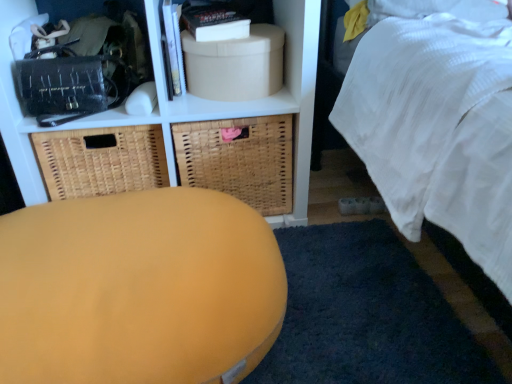
Question: From a real-world perspective, is woven brown basket at left, the 2th basket positioned from the right, located higher than woven brown basket at center, which appears as the second basket when viewed from the left?

Choices:
 (A) no
 (B) yes

Answer: (B)

Question: From a real-world perspective, is woven brown basket at left, the 2th basket positioned from the right, physically below woven brown basket at center, the first basket viewed from the right?

Choices:
 (A) yes
 (B) no

Answer: (B)

Question: Is woven brown basket at center, which appears as the second basket when viewed from the left, at the back of woven brown basket at left, the 2th basket positioned from the right?

Choices:
 (A) yes
 (B) no

Answer: (B)

Question: Can you confirm if woven brown basket at left, the first basket in the left-to-right sequence, is taller than woven brown basket at center, which appears as the second basket when viewed from the left?

Choices:
 (A) yes
 (B) no

Answer: (B)

Question: Is woven brown basket at left, the 2th basket positioned from the right, not near woven brown basket at center, which appears as the second basket when viewed from the left?

Choices:
 (A) no
 (B) yes

Answer: (A)

Question: Does point (309, 155) appear closer or farther from the camera than point (55, 347)?

Choices:
 (A) closer
 (B) farther

Answer: (B)

Question: Choose the correct answer: Is matte white shelf at upper center inside matte yellow ottoman at center or outside it?

Choices:
 (A) inside
 (B) outside

Answer: (B)

Question: Considering the positions of matte white shelf at upper center and matte yellow ottoman at center in the image, is matte white shelf at upper center wider or thinner than matte yellow ottoman at center?

Choices:
 (A) wide
 (B) thin

Answer: (B)

Question: Is matte white shelf at upper center to the left or to the right of matte yellow ottoman at center in the image?

Choices:
 (A) right
 (B) left

Answer: (A)

Question: From their relative heights in the image, would you say woven brown basket at center, the first basket viewed from the right, is taller or shorter than matte yellow ottoman at center?

Choices:
 (A) tall
 (B) short

Answer: (A)

Question: Considering the positions of woven brown basket at center, the first basket viewed from the right, and matte yellow ottoman at center in the image, is woven brown basket at center, the first basket viewed from the right, wider or thinner than matte yellow ottoman at center?

Choices:
 (A) wide
 (B) thin

Answer: (B)

Question: Which is correct: woven brown basket at center, which appears as the second basket when viewed from the left, is inside matte yellow ottoman at center, or outside of it?

Choices:
 (A) outside
 (B) inside

Answer: (A)

Question: Visually, is woven brown basket at center, the first basket viewed from the right, positioned to the left or to the right of matte yellow ottoman at center?

Choices:
 (A) left
 (B) right

Answer: (B)

Question: In terms of height, does beige cardboard box at upper center look taller or shorter compared to matte black book at upper center?

Choices:
 (A) tall
 (B) short

Answer: (A)

Question: Looking at the image, does beige cardboard box at upper center seem bigger or smaller compared to matte black book at upper center?

Choices:
 (A) small
 (B) big

Answer: (B)